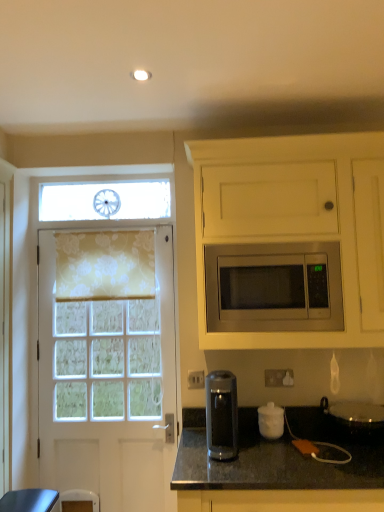
Question: From a real-world perspective, is stainless steel microwave at center beneath transparent plastic coffee machine at lower center?

Choices:
 (A) yes
 (B) no

Answer: (B)

Question: Is stainless steel microwave at center to the left of transparent plastic coffee machine at lower center from the viewer's perspective?

Choices:
 (A) no
 (B) yes

Answer: (A)

Question: Is stainless steel microwave at center oriented away from transparent plastic coffee machine at lower center?

Choices:
 (A) yes
 (B) no

Answer: (B)

Question: From the image's perspective, is stainless steel microwave at center above transparent plastic coffee machine at lower center?

Choices:
 (A) yes
 (B) no

Answer: (A)

Question: Is stainless steel microwave at center placed right next to transparent plastic coffee machine at lower center?

Choices:
 (A) no
 (B) yes

Answer: (A)

Question: In terms of width, does white floral fabric at left look wider or thinner when compared to white matte cabinet at upper right?

Choices:
 (A) wide
 (B) thin

Answer: (B)

Question: Is point (125, 345) closer or farther from the camera than point (269, 229)?

Choices:
 (A) farther
 (B) closer

Answer: (A)

Question: Based on their sizes in the image, would you say white floral fabric at left is bigger or smaller than white matte cabinet at upper right?

Choices:
 (A) big
 (B) small

Answer: (B)

Question: Based on their positions, is white floral fabric at left located to the left or right of white matte cabinet at upper right?

Choices:
 (A) left
 (B) right

Answer: (A)

Question: From the image's perspective, is stainless steel microwave at center positioned above or below metallic silver pot at lower right, the 2th appliance positioned from the left?

Choices:
 (A) below
 (B) above

Answer: (B)

Question: Considering the positions of point (324, 258) and point (347, 421), is point (324, 258) closer or farther from the camera than point (347, 421)?

Choices:
 (A) farther
 (B) closer

Answer: (B)

Question: Considering their positions, is stainless steel microwave at center located in front of or behind metallic silver pot at lower right, the 2th appliance positioned from the left?

Choices:
 (A) behind
 (B) front

Answer: (A)

Question: Looking at the image, does stainless steel microwave at center seem bigger or smaller compared to metallic silver pot at lower right, which is the 1th appliance in right-to-left order?

Choices:
 (A) small
 (B) big

Answer: (B)

Question: Considering the positions of transparent plastic coffee machine at lower center and stainless steel microwave at center in the image, is transparent plastic coffee machine at lower center taller or shorter than stainless steel microwave at center?

Choices:
 (A) short
 (B) tall

Answer: (A)

Question: From the image's perspective, is transparent plastic coffee machine at lower center located above or below stainless steel microwave at center?

Choices:
 (A) below
 (B) above

Answer: (A)